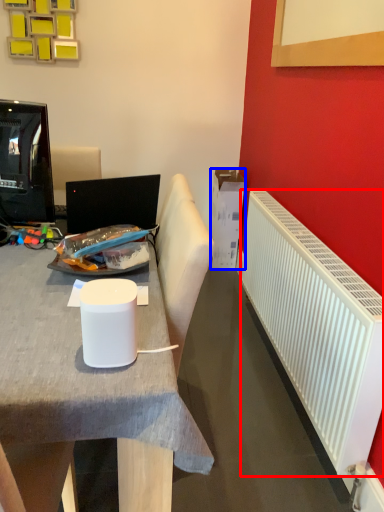
Question: Which of the following is the closest to the observer, radiator (highlighted by a red box) or box (highlighted by a blue box)?

Choices:
 (A) radiator
 (B) box

Answer: (A)